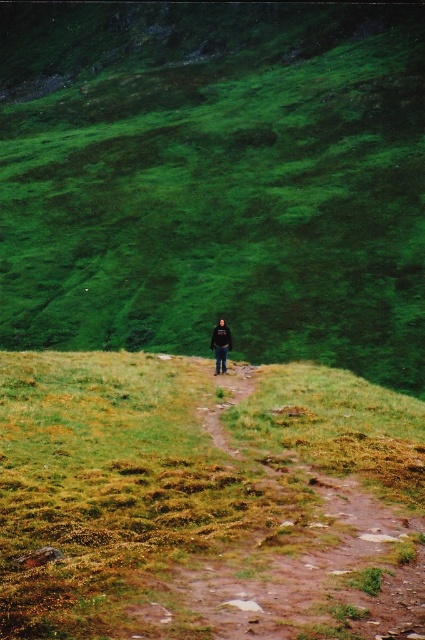
Question: Which point appears farthest from the camera in this image?

Choices:
 (A) (218, 323)
 (B) (257, 579)

Answer: (A)

Question: Does green mossy ground at center have a lesser width compared to black fabric person at center?

Choices:
 (A) no
 (B) yes

Answer: (A)

Question: Is green grassy hillside at center bigger than green mossy ground at center?

Choices:
 (A) no
 (B) yes

Answer: (B)

Question: Which object is farther from the camera taking this photo?

Choices:
 (A) green mossy ground at center
 (B) green grassy hillside at center

Answer: (B)

Question: Estimate the real-world distances between objects in this image. Which object is farther from the green grassy hillside at center?

Choices:
 (A) green mossy ground at center
 (B) black fabric person at center

Answer: (B)

Question: Can you confirm if green grassy hillside at center is positioned to the left of black fabric person at center?

Choices:
 (A) no
 (B) yes

Answer: (B)